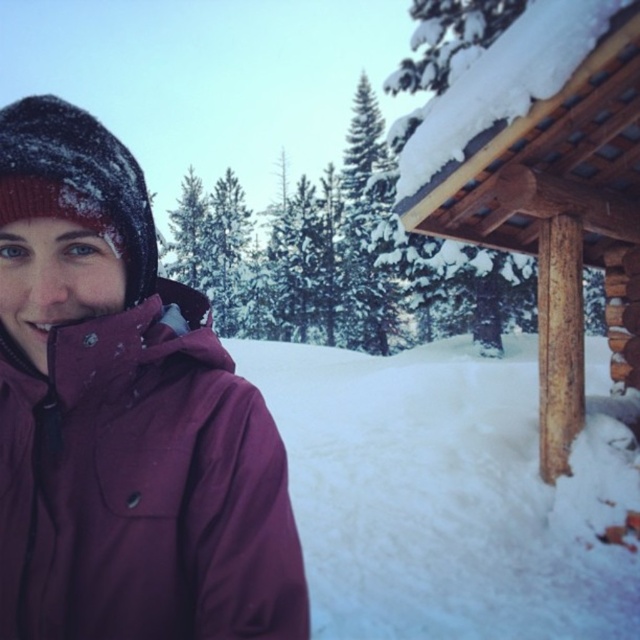
What do you see at coordinates (554, 208) in the screenshot? I see `wooden cabin at right` at bounding box center [554, 208].

You are a GUI agent. You are given a task and a screenshot of the screen. Output one action in this format:
    pyautogui.click(x=<x>, y=<y>)
    Task: Click on the wooden cabin at right
    The width and height of the screenshot is (640, 640).
    Given the screenshot: What is the action you would take?
    pyautogui.click(x=554, y=208)

Is white fluffy snow at lower center taller than matte purple jacket at left?

Correct, white fluffy snow at lower center is much taller as matte purple jacket at left.

Looking at this image, between white fluffy snow at lower center and matte purple jacket at left, which one is positioned lower?

Positioned lower is white fluffy snow at lower center.

The width and height of the screenshot is (640, 640). Find the location of `white fluffy snow at lower center`. white fluffy snow at lower center is located at coordinates (448, 493).

Between white fluffy snow at lower center and wooden cabin at right, which one appears on the right side from the viewer's perspective?

white fluffy snow at lower center is more to the right.

Locate an element on the screen. Image resolution: width=640 pixels, height=640 pixels. white fluffy snow at lower center is located at coordinates (448, 493).

Find the location of `white fluffy snow at lower center`. white fluffy snow at lower center is located at coordinates (448, 493).